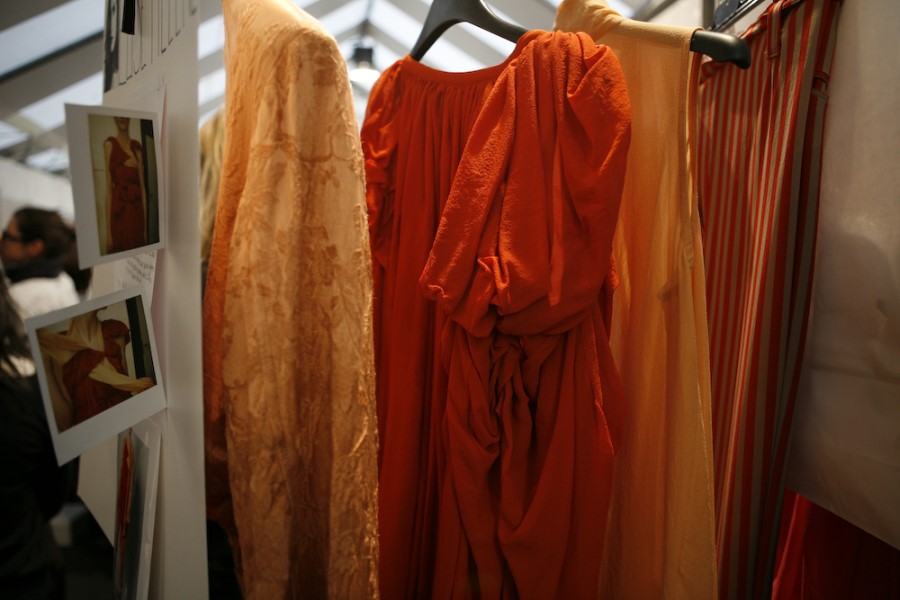
You are a GUI agent. You are given a task and a screenshot of the screen. Output one action in this format:
    pyautogui.click(x=<x>, y=<y>)
    Task: Click on the ceiling
    
    Given the screenshot: What is the action you would take?
    pyautogui.click(x=384, y=19)